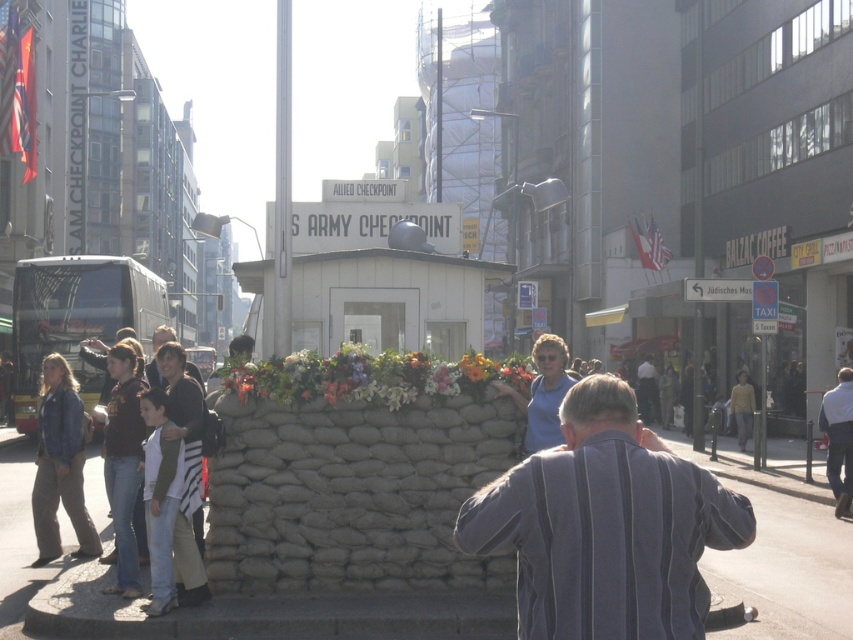
You are a tourist standing at Checkpoint Charlie in Berlin. You notice a striped fabric shirt at center and a yellowish metallic bus at left. Which object is nearer to you?

The striped fabric shirt at center is closer to the viewer than the yellowish metallic bus at left.

Consider the image. You are a tourist standing in front of the historical Checkpoint Charlie building. You notice a striped fabric shirt at center and a gray concrete pavement at center. Which object is nearer to you?

The striped fabric shirt at center is closer to the viewer than the gray concrete pavement at center.